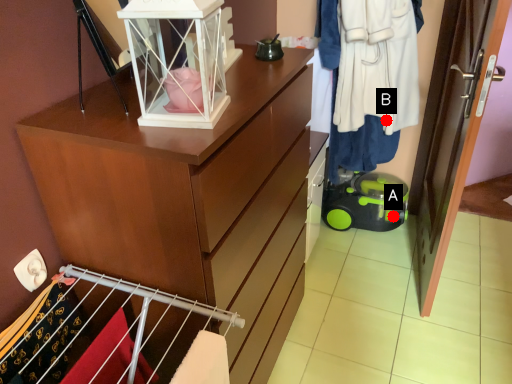
Question: Two points are circled on the image, labeled by A and B beside each circle. Among these points, which one is nearest to the camera?

Choices:
 (A) A is closer
 (B) B is closer

Answer: (B)